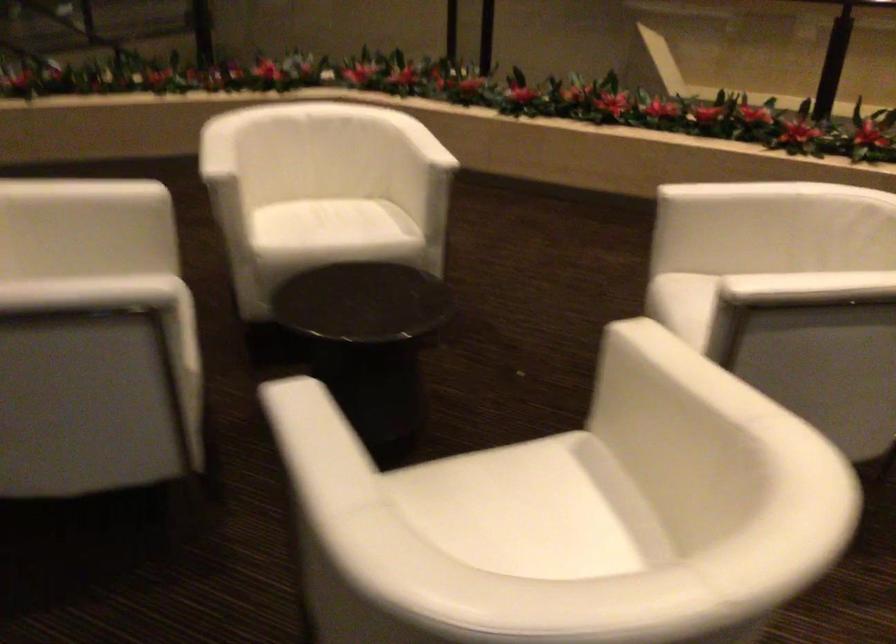
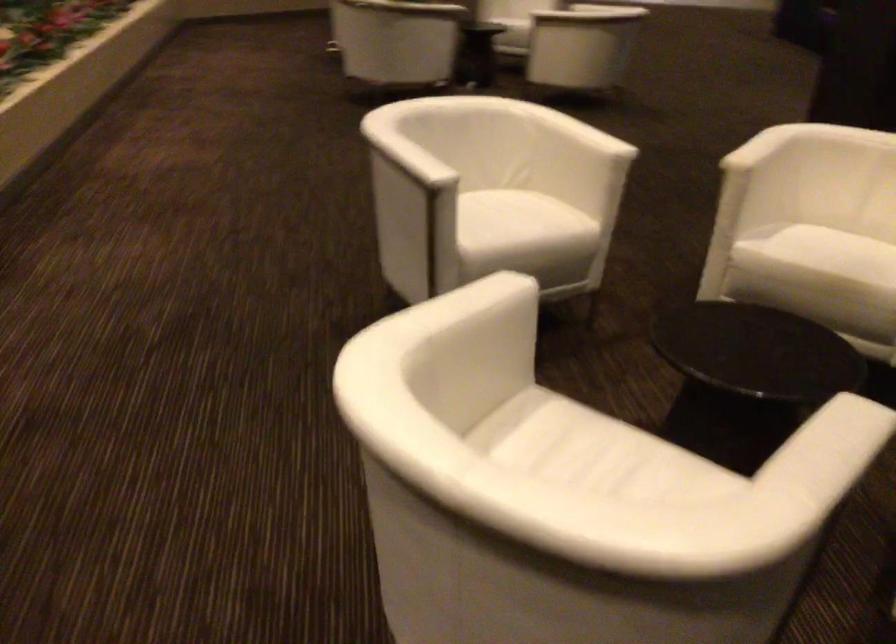
Locate, in the second image, the point that corresponds to point (214, 154) in the first image.

(839, 446)